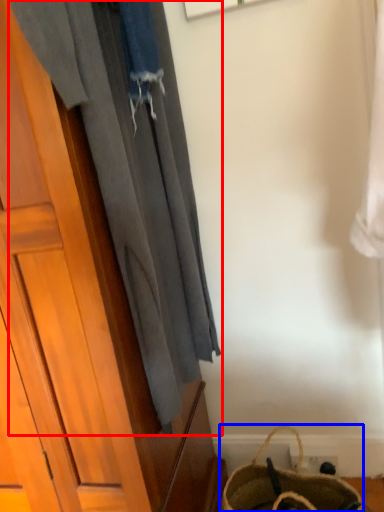
Question: Which object is closer to the camera taking this photo, curtain (highlighted by a red box) or handbag (highlighted by a blue box)?

Choices:
 (A) curtain
 (B) handbag

Answer: (A)